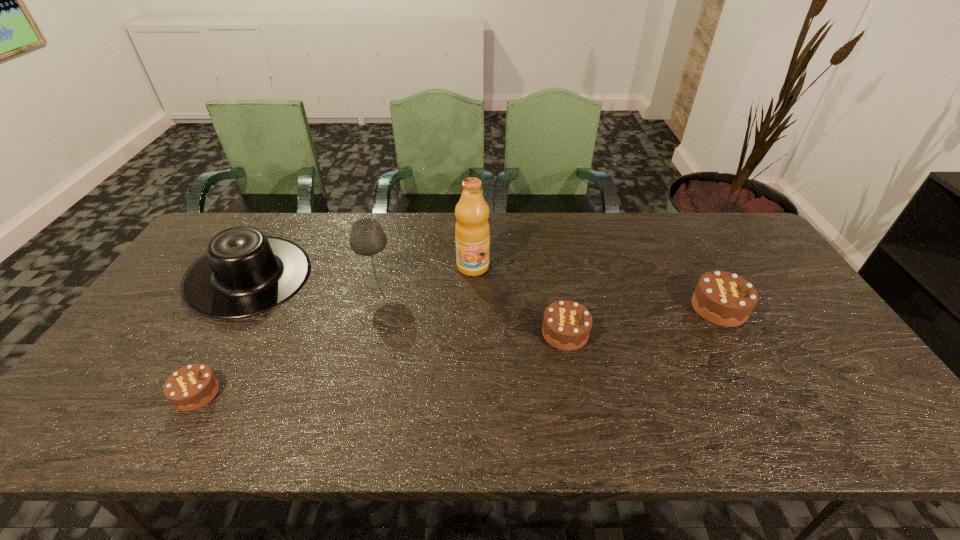
To make them evenly spaced by inserting another chocolate_cake among them, please locate a free space for this new chocolate_cake. Please provide its 2D coordinates. Your answer should be formatted as a tuple, i.e. [(x, y)], where the tuple contains the x and y coordinates of a point satisfying the conditions above.

[(393, 361)]